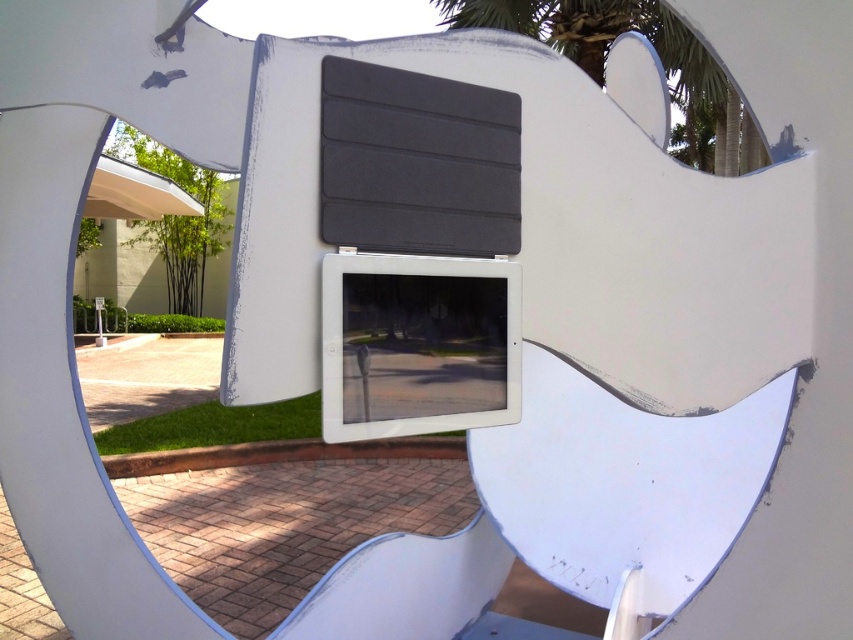
You are standing in the outdoor area shown in the image. There is a point at coordinates (659, 56). Which object in the scene does this point belong to?

The point at coordinates (659, 56) is on the green leafy palm tree at upper right.